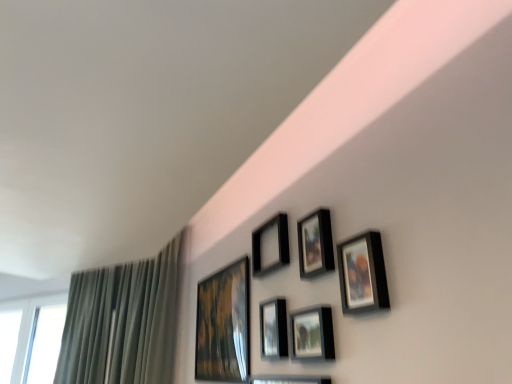
I want to click on matte black picture frame at lower center, which is counted as the 4th picture frame, starting from the left, so click(312, 334).

Where is `matte gold painting at upper center, which is the sixth picture frame from right to left`? matte gold painting at upper center, which is the sixth picture frame from right to left is located at coordinates (223, 325).

This screenshot has height=384, width=512. I want to click on matte black picture frame at center, the fourth picture frame from the right, so click(273, 329).

How much space does matte black picture frame at upper right, arranged as the 6th picture frame when viewed from the left, occupy horizontally?

It is 1.40 inches.

Where is `matte black picture frame at upper center, the 5th picture frame positioned from the left`? matte black picture frame at upper center, the 5th picture frame positioned from the left is located at coordinates (315, 244).

Can you confirm if green fabric curtain at left is smaller than matte gold painting at upper center, arranged as the 1th picture frame when viewed from the left?

No.

Which is more to the right, green fabric curtain at left or matte gold painting at upper center, arranged as the 1th picture frame when viewed from the left?

From the viewer's perspective, matte gold painting at upper center, arranged as the 1th picture frame when viewed from the left, appears more on the right side.

How different are the orientations of green fabric curtain at left and matte gold painting at upper center, arranged as the 1th picture frame when viewed from the left, in degrees?

They differ by 33.9 degrees in their facing directions.

Which is in front, matte black picture frame at upper center, acting as the second picture frame starting from the left, or white glass window at lower left?

Positioned in front is matte black picture frame at upper center, acting as the second picture frame starting from the left.

Is white glass window at lower left completely or partially inside matte black picture frame at upper center, acting as the second picture frame starting from the left?

No, white glass window at lower left is not surrounded by matte black picture frame at upper center, acting as the second picture frame starting from the left.

Does point (278, 222) appear closer or farther from the camera than point (54, 307)?

Point (278, 222) is positioned closer to the camera compared to point (54, 307).

Can you tell me how much matte black picture frame at upper center, acting as the second picture frame starting from the left, and white glass window at lower left differ in facing direction?

34.9 degrees.

Looking at this image, is matte gold painting at upper center, arranged as the 1th picture frame when viewed from the left, directly adjacent to white glass window at lower left?

No, matte gold painting at upper center, arranged as the 1th picture frame when viewed from the left, is not touching white glass window at lower left.

Is matte gold painting at upper center, arranged as the 1th picture frame when viewed from the left, shorter than white glass window at lower left?

Yes, matte gold painting at upper center, arranged as the 1th picture frame when viewed from the left, is shorter than white glass window at lower left.

Is matte gold painting at upper center, arranged as the 1th picture frame when viewed from the left, spatially inside white glass window at lower left, or outside of it?

matte gold painting at upper center, arranged as the 1th picture frame when viewed from the left, lies outside white glass window at lower left.

In the scene shown: From the image's perspective, would you say matte gold painting at upper center, which is the sixth picture frame from right to left, is positioned over white glass window at lower left?

Yes, from the image's perspective, matte gold painting at upper center, which is the sixth picture frame from right to left, is over white glass window at lower left.

Measure the distance between matte black picture frame at lower center, arranged as the 3th picture frame when viewed from the right, and green fabric curtain at left.

The distance of matte black picture frame at lower center, arranged as the 3th picture frame when viewed from the right, from green fabric curtain at left is 1.79 meters.

Locate an element on the screen. The image size is (512, 384). curtain behind the matte black picture frame at lower center, which is counted as the 4th picture frame, starting from the left is located at coordinates (122, 322).

From a real-world perspective, between matte black picture frame at lower center, arranged as the 3th picture frame when viewed from the right, and green fabric curtain at left, who is vertically lower?

matte black picture frame at lower center, arranged as the 3th picture frame when viewed from the right.

Is matte black picture frame at lower center, which is counted as the 4th picture frame, starting from the left, outside of green fabric curtain at left?

Yes, matte black picture frame at lower center, which is counted as the 4th picture frame, starting from the left, is outside of green fabric curtain at left.

From the image's perspective, who appears lower, white glass window at lower left or matte black picture frame at upper right, arranged as the 6th picture frame when viewed from the left?

white glass window at lower left appears lower in the image.

Considering the positions of objects white glass window at lower left and matte black picture frame at upper right, arranged as the 6th picture frame when viewed from the left, in the image provided, who is in front, white glass window at lower left or matte black picture frame at upper right, arranged as the 6th picture frame when viewed from the left,?

Positioned in front is matte black picture frame at upper right, arranged as the 6th picture frame when viewed from the left.

Is matte black picture frame at upper center, the 5th picture frame positioned from the left, spatially inside white glass window at lower left, or outside of it?

matte black picture frame at upper center, the 5th picture frame positioned from the left, is outside white glass window at lower left.

What's the angular difference between matte black picture frame at upper center, the 5th picture frame positioned from the left, and white glass window at lower left's facing directions?

They differ by 34.9 degrees in their facing directions.

From a real-world perspective, is matte black picture frame at upper center, the 5th picture frame positioned from the left, located higher than white glass window at lower left?

Yes, from a real-world perspective, matte black picture frame at upper center, the 5th picture frame positioned from the left, is above white glass window at lower left.

At what (x,y) coordinates should I click in order to perform the action: click on the 1st picture frame in front of the white glass window at lower left. Please return your answer as a coordinate pair (x, y). Looking at the image, I should click on (223, 325).

Is white glass window at lower left positioned behind matte gold painting at upper center, which is the sixth picture frame from right to left?

Yes, white glass window at lower left is further from the viewer.

Considering the relative sizes of white glass window at lower left and matte gold painting at upper center, which is the sixth picture frame from right to left, in the image provided, is white glass window at lower left smaller than matte gold painting at upper center, which is the sixth picture frame from right to left,?

Incorrect, white glass window at lower left is not smaller in size than matte gold painting at upper center, which is the sixth picture frame from right to left.

In order to click on the 1st picture frame in front of the green fabric curtain at left in this screenshot , I will do `click(223, 325)`.

Identify the location of picture frame that is the 4th one when counting upward from the white glass window at lower left (from the image's perspective). Image resolution: width=512 pixels, height=384 pixels. (270, 245).

Which object lies further to the anchor point matte black picture frame at upper right, arranged as the 1th picture frame when viewed from the right, matte black picture frame at center, the 3th picture frame viewed from the left, or matte black picture frame at upper center, arranged as the 2th picture frame when viewed from the right?

Among the two, matte black picture frame at center, the 3th picture frame viewed from the left, is located further to matte black picture frame at upper right, arranged as the 1th picture frame when viewed from the right.

Considering their positions, is white glass window at lower left positioned further to matte black picture frame at upper center, acting as the second picture frame starting from the left, than matte gold painting at upper center, which is the sixth picture frame from right to left?

Among the two, white glass window at lower left is located further to matte black picture frame at upper center, acting as the second picture frame starting from the left.

Considering their positions, is matte black picture frame at upper center, the 5th picture frame positioned from the left, positioned closer to matte black picture frame at lower center, which is counted as the 4th picture frame, starting from the left, than matte gold painting at upper center, arranged as the 1th picture frame when viewed from the left?

The object closer to matte black picture frame at lower center, which is counted as the 4th picture frame, starting from the left, is matte black picture frame at upper center, the 5th picture frame positioned from the left.

Which object lies further to the anchor point matte black picture frame at lower center, which is counted as the 4th picture frame, starting from the left, white glass window at lower left or matte black picture frame at upper right, arranged as the 1th picture frame when viewed from the right?

white glass window at lower left.

Which object lies nearer to the anchor point matte black picture frame at upper right, arranged as the 6th picture frame when viewed from the left, matte black picture frame at upper center, arranged as the 2th picture frame when viewed from the right, or matte black picture frame at center, the 3th picture frame viewed from the left?

matte black picture frame at upper center, arranged as the 2th picture frame when viewed from the right, lies closer to matte black picture frame at upper right, arranged as the 6th picture frame when viewed from the left, than the other object.

From the image, which object appears to be nearer to matte black picture frame at upper center, which ranks as the fifth picture frame in right-to-left order, matte black picture frame at upper center, the 5th picture frame positioned from the left, or white glass window at lower left?

Among the two, matte black picture frame at upper center, the 5th picture frame positioned from the left, is located nearer to matte black picture frame at upper center, which ranks as the fifth picture frame in right-to-left order.

Estimate the real-world distances between objects in this image. Which object is further from matte gold painting at upper center, arranged as the 1th picture frame when viewed from the left, matte black picture frame at lower center, arranged as the 3th picture frame when viewed from the right, or matte black picture frame at upper right, arranged as the 1th picture frame when viewed from the right?

matte black picture frame at upper right, arranged as the 1th picture frame when viewed from the right.

From the image, which object appears to be nearer to matte black picture frame at upper center, acting as the second picture frame starting from the left, matte black picture frame at upper right, arranged as the 1th picture frame when viewed from the right, or matte black picture frame at center, the 3th picture frame viewed from the left?

Based on the image, matte black picture frame at center, the 3th picture frame viewed from the left, appears to be nearer to matte black picture frame at upper center, acting as the second picture frame starting from the left.

Identify the location of curtain between white glass window at lower left and matte gold painting at upper center, which is the sixth picture frame from right to left, in the horizontal direction. (122, 322).

Locate an element on the screen. This screenshot has height=384, width=512. curtain between white glass window at lower left and matte black picture frame at upper center, acting as the second picture frame starting from the left, from left to right is located at coordinates pos(122,322).

Image resolution: width=512 pixels, height=384 pixels. Identify the location of curtain between white glass window at lower left and matte black picture frame at upper right, arranged as the 1th picture frame when viewed from the right, from left to right. [x=122, y=322].

Find the location of a particular element. curtain between white glass window at lower left and matte black picture frame at lower center, which is counted as the 4th picture frame, starting from the left, in the horizontal direction is located at coordinates (122, 322).